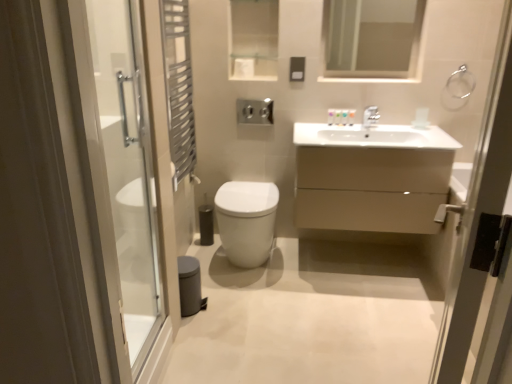
The width and height of the screenshot is (512, 384). I want to click on vacant space situated above matte beige cabinet at center (from a real-world perspective), so click(x=359, y=131).